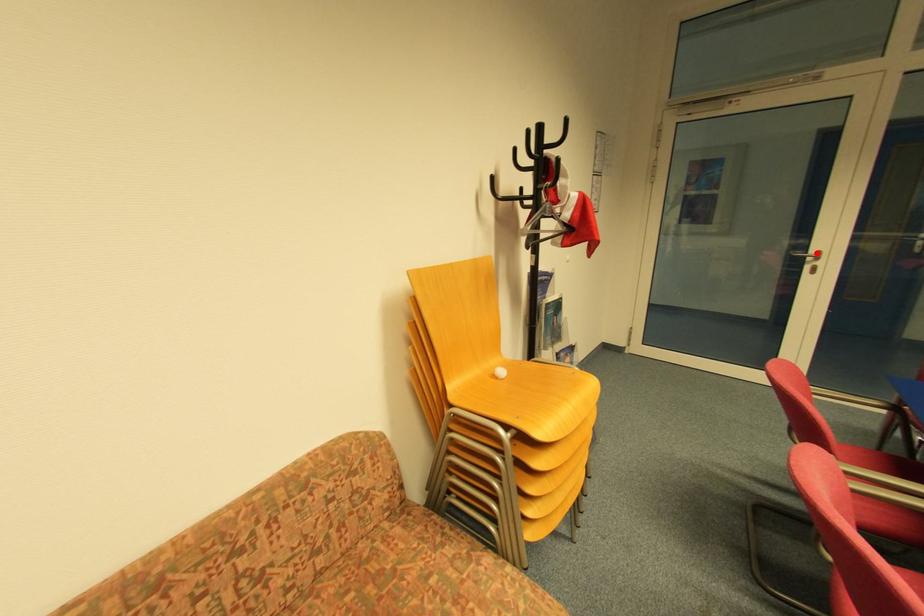
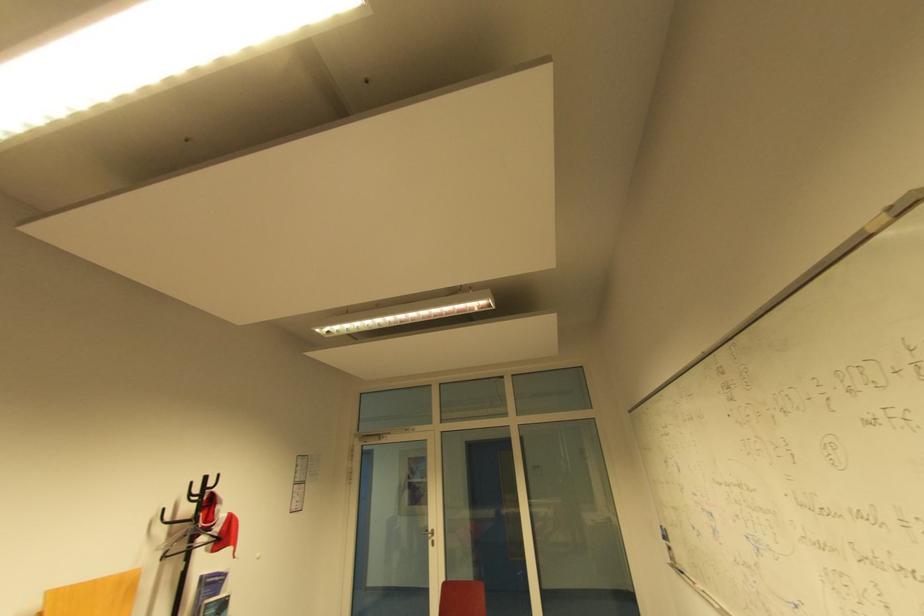
Question: I am providing you with two images of the same scene from different viewpoints. Given a red point in image1, look at the same physical point in image2. Is it:

Choices:
 (A) Closer to the viewpoint
 (B) Farther from the viewpoint

Answer: (B)